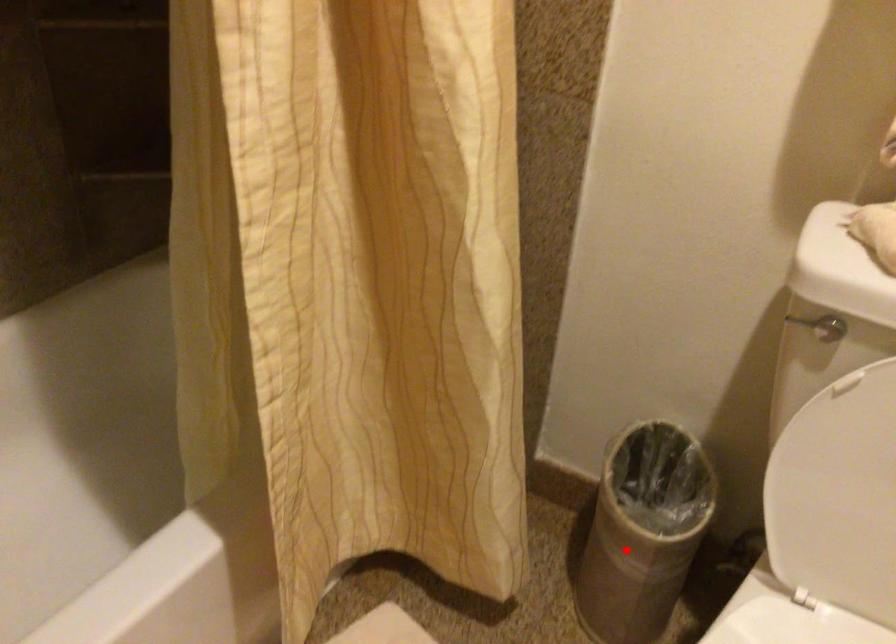
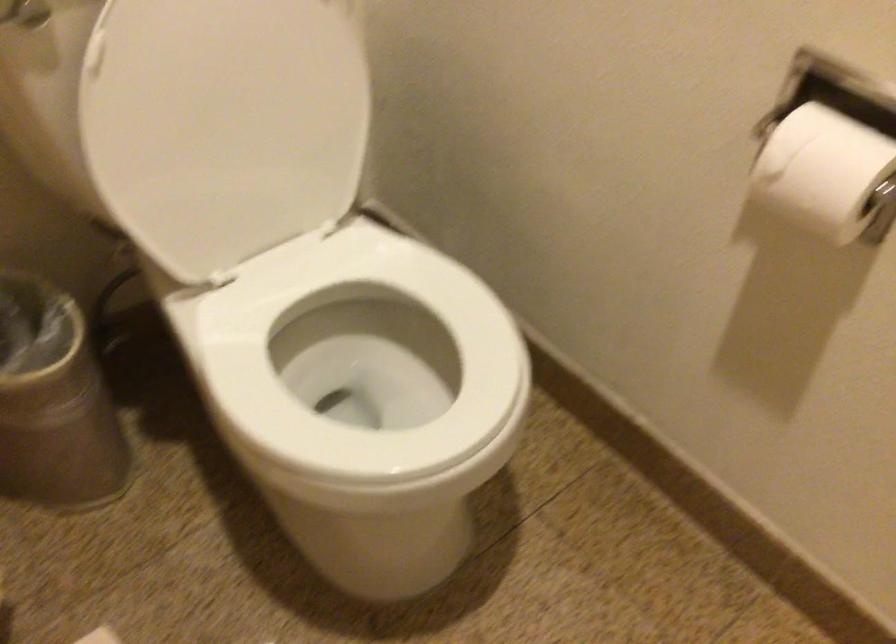
Where in the second image is the point corresponding to the highlighted location from the first image?

(54, 402)